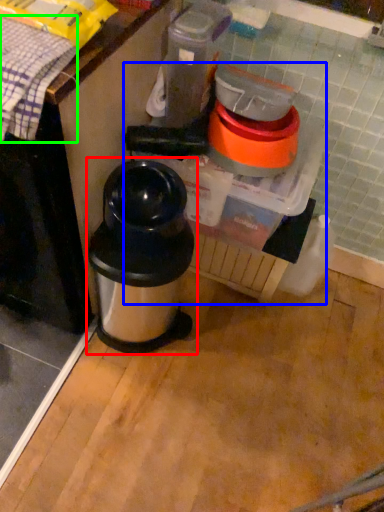
Question: Which object is the closest to the waste container (highlighted by a red box)? Choose among these: blender (highlighted by a blue box) or blanket (highlighted by a green box).

Choices:
 (A) blender
 (B) blanket

Answer: (A)